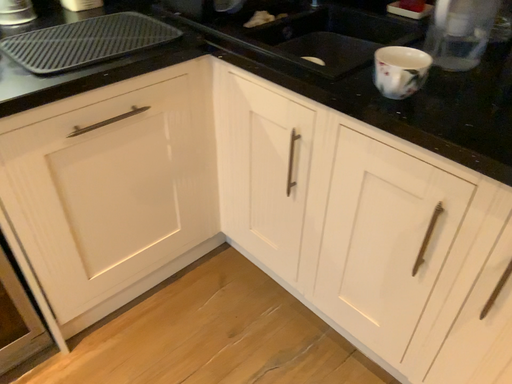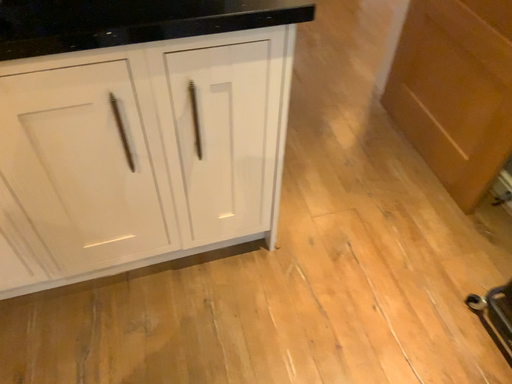
Question: Which way did the camera rotate in the video?

Choices:
 (A) rotated left
 (B) rotated right

Answer: (B)